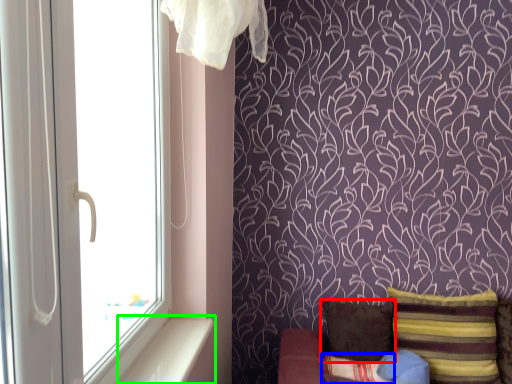
Question: Which is farther away from pillow (highlighted by a red box)? pillow (highlighted by a blue box) or window sill (highlighted by a green box)?

Choices:
 (A) pillow
 (B) window sill

Answer: (B)